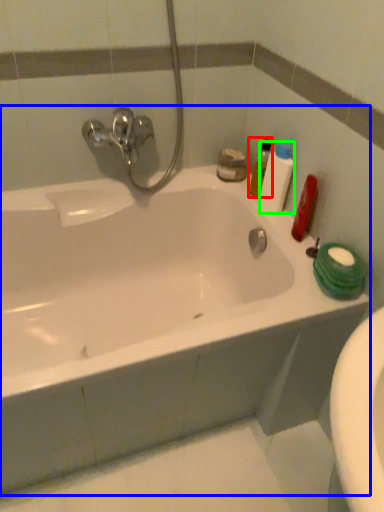
Question: Which object is the closest to the cleaning product (highlighted by a red box)? Choose among these: bathtub (highlighted by a blue box) or toiletry (highlighted by a green box).

Choices:
 (A) bathtub
 (B) toiletry

Answer: (B)